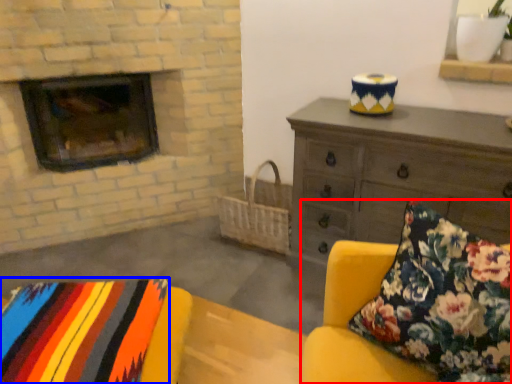
Question: Which object is further to the camera taking this photo, studio couch (highlighted by a red box) or blanket (highlighted by a blue box)?

Choices:
 (A) studio couch
 (B) blanket

Answer: (B)